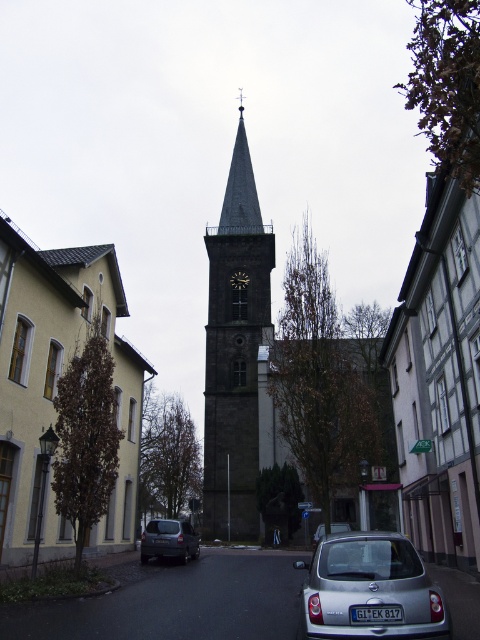
You are standing on the street in front of the dark gray stone church at center and the dark gray stone clock tower at center. Which one is positioned higher up in the image?

The dark gray stone clock tower at center is positioned higher up in the image because the dark gray stone church at center is below it.

You are driving a car that is 4.5 meters long and want to park it between the yellow stucco building at left and the silver metallic hatchback at center. Is there enough space?

The distance between the yellow stucco building at left and the silver metallic hatchback at center is 25.29 meters. Since your car is only 4.5 meters long, there is plenty of space to park between them.

You are a tourist standing at the entrance of the street, and you want to take a photo that includes both the dark gray stone church at center and the dark gray stone clock tower at center. Given that your camera has a maximum focus range of 60 meters, will you be able to capture both in the same frame without moving your position?

The dark gray stone church at center is 63.00 meters from the dark gray stone clock tower at center, which exceeds the camera maximum focus range of 60 meters. Therefore, you cannot capture both in the same frame without moving your position.